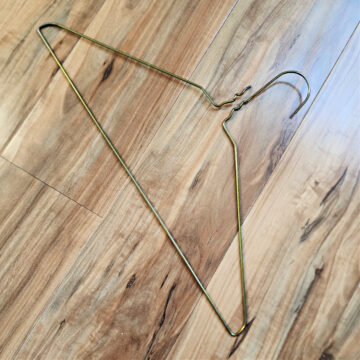
Where is `the back of hook on hangar`? the back of hook on hangar is located at coordinates (267, 83).